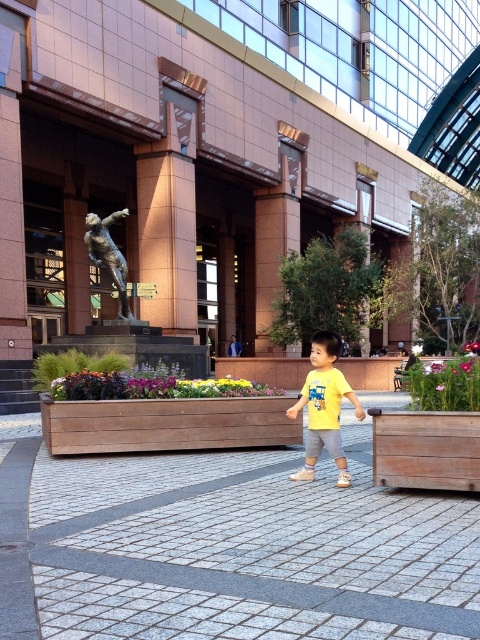
Question: Which point appears closest to the camera in this image?

Choices:
 (A) (12, 378)
 (B) (331, 333)
 (C) (154, 252)
 (D) (120, 275)

Answer: (B)

Question: Is yellow matte shirt at center above bronze statue at center?

Choices:
 (A) no
 (B) yes

Answer: (A)

Question: Considering the relative positions of sandy beige stone statue at upper center and bronze statue at center in the image provided, where is sandy beige stone statue at upper center located with respect to bronze statue at center?

Choices:
 (A) below
 (B) above

Answer: (B)

Question: Is gray concrete pavement at center bigger than bronze statue at center?

Choices:
 (A) no
 (B) yes

Answer: (A)

Question: Which object appears farthest from the camera in this image?

Choices:
 (A) brown stone mall at center
 (B) gray concrete pavement at center
 (C) yellow matte shirt at center

Answer: (A)

Question: Which object is the farthest from the sandy beige stone statue at upper center?

Choices:
 (A) brown stone mall at center
 (B) bronze statue at center
 (C) yellow matte shirt at center
 (D) gray concrete pavement at center

Answer: (D)